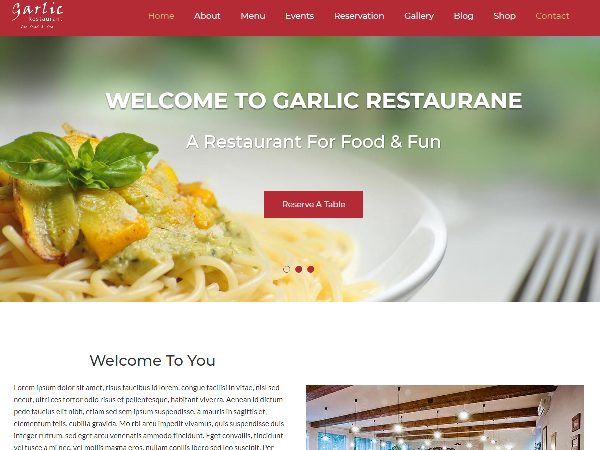
At what (x,y) coordinates should I click in order to perform the action: click on wood beams. Please return your answer as a coordinate pair (x, y). The image size is (600, 450). Looking at the image, I should click on (328, 387), (445, 402), (447, 420), (468, 427), (470, 432).